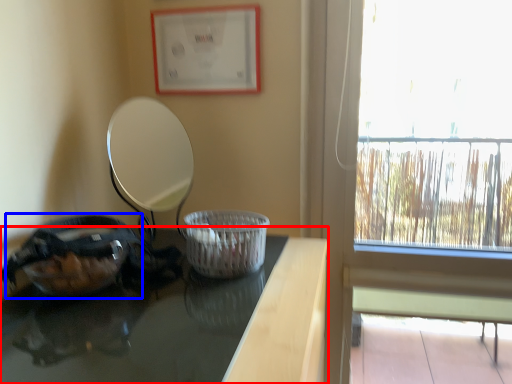
Question: Which of the following is the farthest to the observer, table (highlighted by a red box) or glass bowl (highlighted by a blue box)?

Choices:
 (A) table
 (B) glass bowl

Answer: (B)